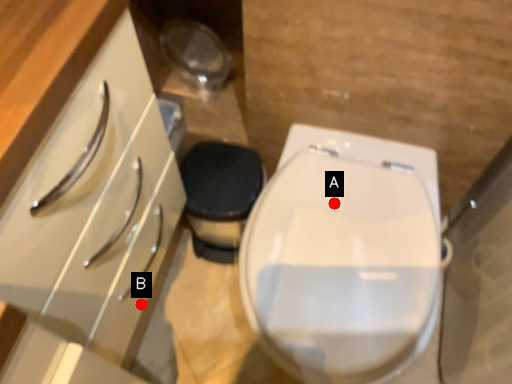
Question: Two points are circled on the image, labeled by A and B beside each circle. Which point is closer to the camera?

Choices:
 (A) A is closer
 (B) B is closer

Answer: (A)